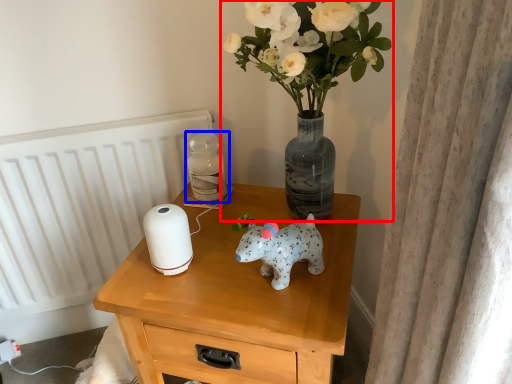
Question: Which object is further to the camera taking this photo, houseplant (highlighted by a red box) or bottle (highlighted by a blue box)?

Choices:
 (A) houseplant
 (B) bottle

Answer: (B)